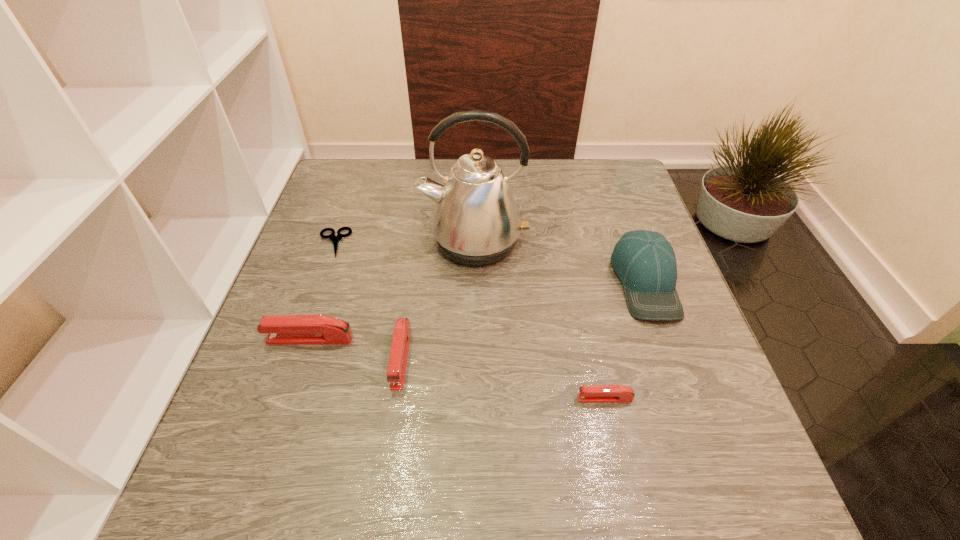
Find the location of a particular element. The width and height of the screenshot is (960, 540). free space located 0.280m on the front-facing side of the shortest stapler is located at coordinates (426, 399).

Locate an element on the screen. The width and height of the screenshot is (960, 540). free location located on the front-facing side of the shortest stapler is located at coordinates (502, 399).

Locate an element on the screen. Image resolution: width=960 pixels, height=540 pixels. vacant space positioned 0.250m on the front-facing side of the shortest stapler is located at coordinates (443, 399).

You are a GUI agent. You are given a task and a screenshot of the screen. Output one action in this format:
    pyautogui.click(x=<x>, y=<y>)
    Task: Click on the vacant space located on the back of the shortest object
    
    Given the screenshot: What is the action you would take?
    pyautogui.click(x=359, y=170)

In order to click on vacant space situated on the front of the rightmost object in this screenshot , I will do `click(681, 380)`.

Where is `vacant area located from the spout of the tallest object`? This screenshot has height=540, width=960. vacant area located from the spout of the tallest object is located at coordinates (472, 373).

This screenshot has height=540, width=960. I want to click on object present at the near edge, so click(x=587, y=393).

This screenshot has width=960, height=540. I want to click on stapler that is at the left edge, so click(x=283, y=329).

Identify the location of shears situated at the left edge. This screenshot has width=960, height=540. (335, 239).

You are a GUI agent. You are given a task and a screenshot of the screen. Output one action in this format:
    pyautogui.click(x=<x>, y=<y>)
    Task: Click on the object situated at the right edge
    The height and width of the screenshot is (540, 960).
    Given the screenshot: What is the action you would take?
    pyautogui.click(x=645, y=262)